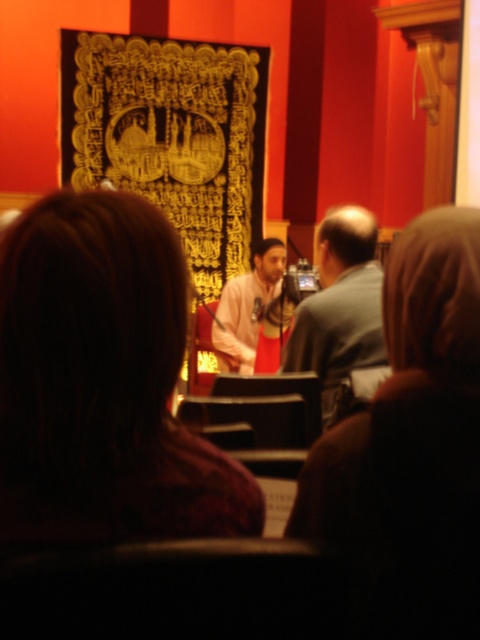
Is point (450, 268) positioned after point (262, 291)?

That is False.

Can you confirm if brown fabric headscarf at center is smaller than pink fabric at center?

No, brown fabric headscarf at center is not smaller than pink fabric at center.

Between point (468, 410) and point (257, 316), which one is positioned in front?

Point (468, 410)

Image resolution: width=480 pixels, height=640 pixels. I want to click on brown fabric headscarf at center, so click(411, 448).

Is dark brown hair at center below brown fabric headscarf at center?

Actually, dark brown hair at center is above brown fabric headscarf at center.

Can you confirm if dark brown hair at center is smaller than brown fabric headscarf at center?

Correct, dark brown hair at center occupies less space than brown fabric headscarf at center.

Is point (123, 442) more distant than point (437, 340)?

No, it is not.

This screenshot has height=640, width=480. I want to click on dark brown hair at center, so click(103, 384).

Is gray fabric shirt at center below pink fabric at center?

Correct, gray fabric shirt at center is located below pink fabric at center.

Which is in front, point (344, 324) or point (260, 323)?

Point (344, 324) is in front.

You are a GUI agent. You are given a task and a screenshot of the screen. Output one action in this format:
    pyautogui.click(x=<x>, y=<y>)
    Task: Click on the gray fabric shirt at center
    
    Given the screenshot: What is the action you would take?
    pyautogui.click(x=339, y=305)

I want to click on gray fabric shirt at center, so click(x=339, y=305).